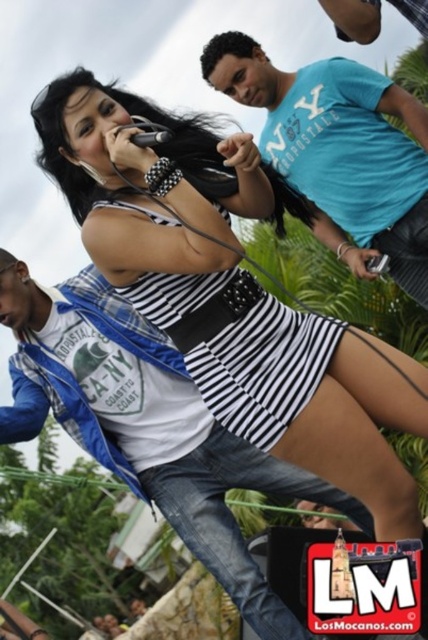
Based on the photo, which of these two, teal cotton t-shirt at upper center or black and white striped dress at center, stands shorter?

With less height is black and white striped dress at center.

The image size is (428, 640). What are the coordinates of `teal cotton t-shirt at upper center` in the screenshot? It's located at (339, 150).

Locate an element on the screen. The height and width of the screenshot is (640, 428). teal cotton t-shirt at upper center is located at coordinates (339, 150).